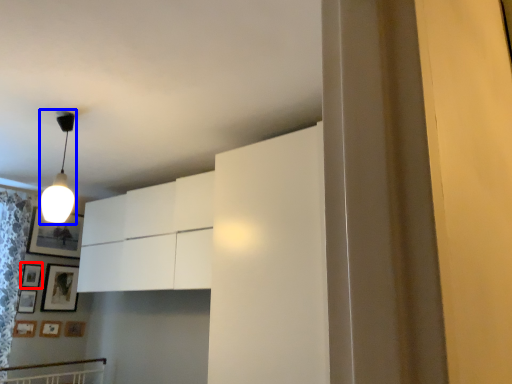
Question: Which point is closer to the camera, picture frame (highlighted by a red box) or lamp (highlighted by a blue box)?

Choices:
 (A) picture frame
 (B) lamp

Answer: (B)